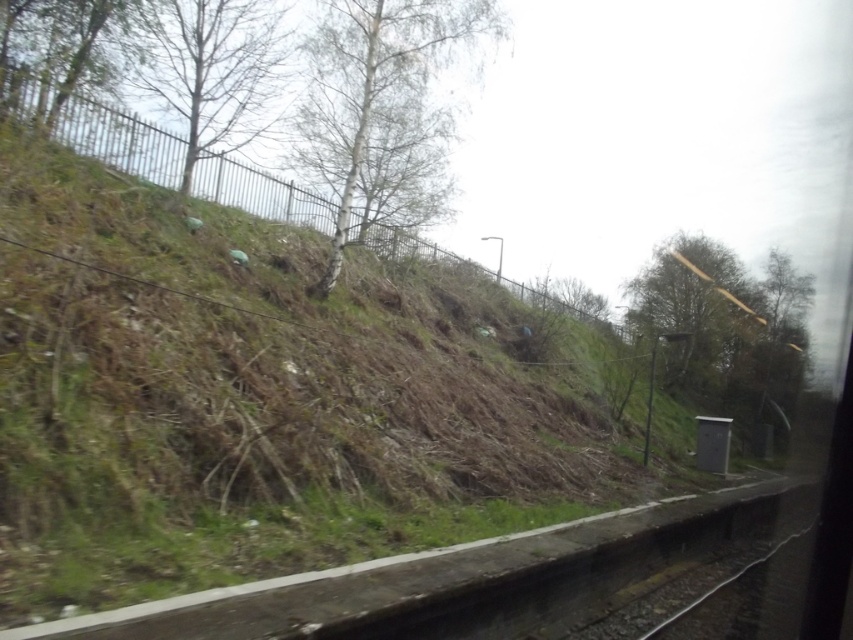
Between point (210, 125) and point (134, 13), which one is positioned in front?

Point (134, 13) is in front.

Between bare wood tree at upper left and green leafy tree at upper left, which one is positioned lower?

green leafy tree at upper left is below.

I want to click on bare wood tree at upper left, so click(x=212, y=68).

Is bare birch at center thinner than black metal fence at upper left?

Yes.

You are a GUI agent. You are given a task and a screenshot of the screen. Output one action in this format:
    pyautogui.click(x=<x>, y=<y>)
    Task: Click on the bare birch at center
    Image resolution: width=853 pixels, height=640 pixels.
    Given the screenshot: What is the action you would take?
    pyautogui.click(x=381, y=109)

Which of these two, black metal fence at upper left or green leafy tree at upper center, stands taller?

Standing taller between the two is green leafy tree at upper center.

This screenshot has width=853, height=640. What do you see at coordinates (120, 140) in the screenshot? I see `black metal fence at upper left` at bounding box center [120, 140].

Is point (144, 160) more distant than point (750, 316)?

No.

Find the location of `black metal fence at upper left`. black metal fence at upper left is located at coordinates (120, 140).